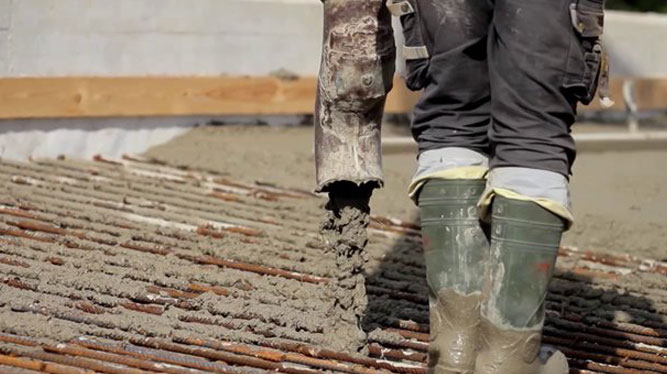
I want to click on wall, so click(x=175, y=31), click(x=63, y=135), click(x=400, y=40), click(x=640, y=36), click(x=648, y=111), click(x=607, y=114), click(x=271, y=118), click(x=237, y=116), click(x=385, y=118).